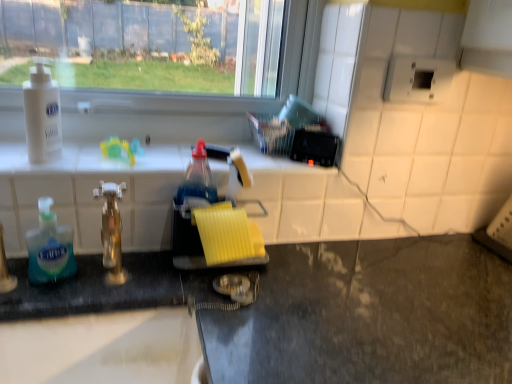
Image resolution: width=512 pixels, height=384 pixels. I want to click on vacant area that lies between yellow sponge at center and translucent plastic soap dispenser at left, the 2th bottle positioned from the top, so click(124, 272).